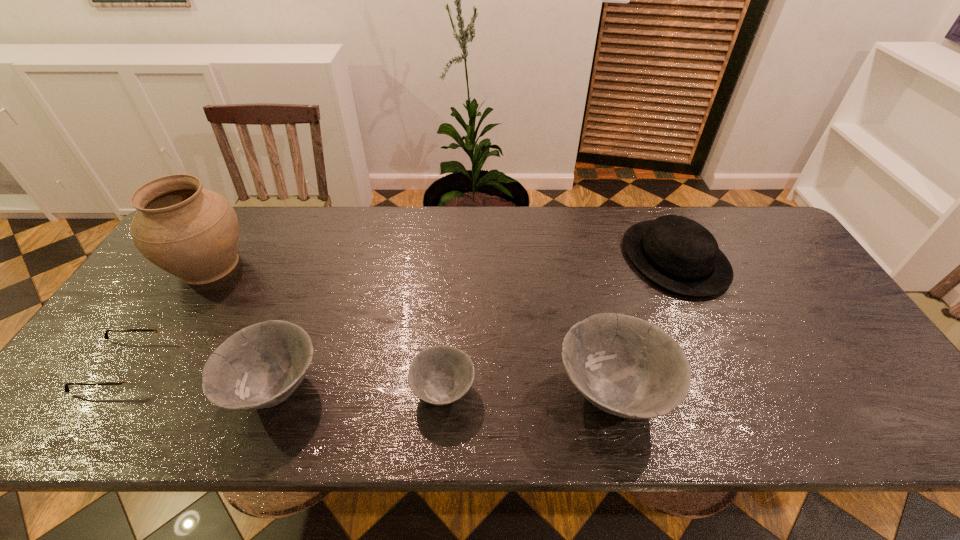
You are a GUI agent. You are given a task and a screenshot of the screen. Output one action in this format:
    pyautogui.click(x=<x>, y=<y>)
    Task: Click on the free space between the rightmost bowl and the second bowl from right to left
    This screenshot has width=960, height=540.
    Given the screenshot: What is the action you would take?
    pyautogui.click(x=528, y=392)

Where is `vacant region between the rightmost object and the shortest bowl`? vacant region between the rightmost object and the shortest bowl is located at coordinates (559, 325).

You are a GUI agent. You are given a task and a screenshot of the screen. Output one action in this format:
    pyautogui.click(x=<x>, y=<y>)
    Task: Click on the free space that is in between the urn and the fourth object from left to right
    The image size is (960, 540).
    Given the screenshot: What is the action you would take?
    pyautogui.click(x=326, y=328)

The image size is (960, 540). I want to click on free area in between the second shortest bowl and the shortest bowl, so click(359, 390).

This screenshot has height=540, width=960. Identify the location of free space between the shortest bowl and the second tallest bowl. (359, 390).

I want to click on empty space that is in between the urn and the shortest object, so click(x=165, y=315).

In order to click on free area in between the rightmost bowl and the shortest object in this screenshot , I will do `click(367, 380)`.

Identify which object is located as the nearest to the rightmost bowl. Please provide its 2D coordinates. Your answer should be formatted as a tuple, i.e. [(x, y)], where the tuple contains the x and y coordinates of a point satisfying the conditions above.

[(677, 253)]

Where is `the third closest object to the second tallest bowl`? The image size is (960, 540). the third closest object to the second tallest bowl is located at coordinates (439, 375).

Identify which bowl is located as the second nearest to the shortest bowl. Please provide its 2D coordinates. Your answer should be formatted as a tuple, i.e. [(x, y)], where the tuple contains the x and y coordinates of a point satisfying the conditions above.

[(260, 366)]